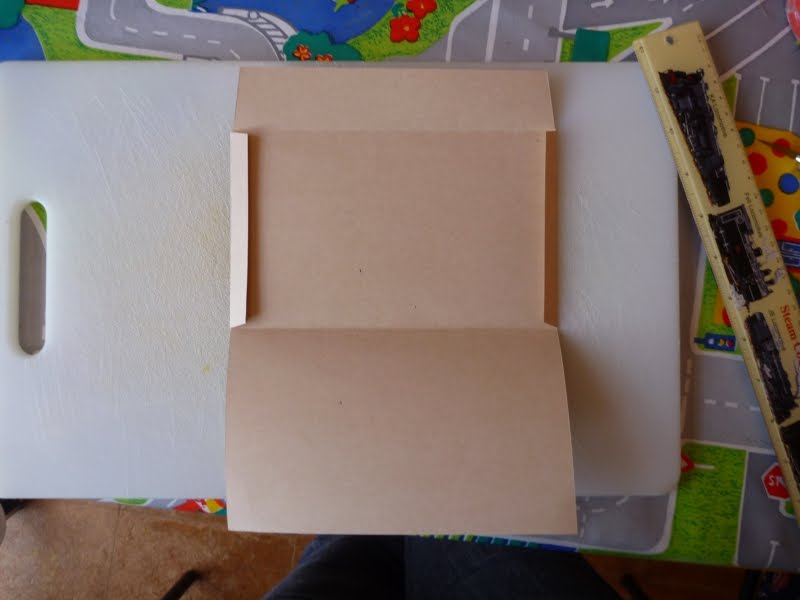
You are a GUI agent. You are given a task and a screenshot of the screen. Output one action in this format:
    pyautogui.click(x=<x>, y=<y>)
    Task: Click on the flower on rug design
    The height and width of the screenshot is (600, 800).
    Given the screenshot: What is the action you would take?
    pyautogui.click(x=398, y=31)